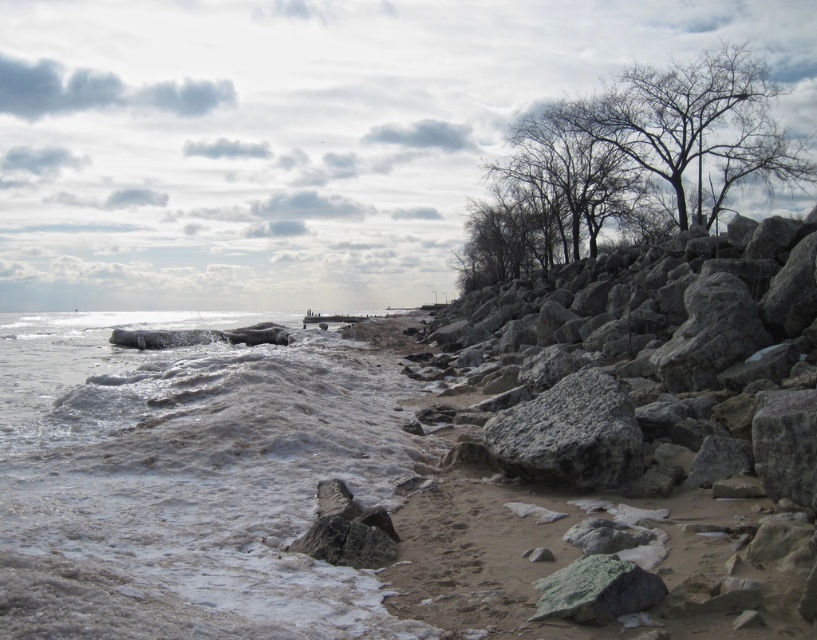
Question: Is white frothy water at lower left below gray rough rock at center-right?

Choices:
 (A) no
 (B) yes

Answer: (A)

Question: Can you confirm if white frothy water at lower left is bigger than bare branches at upper right?

Choices:
 (A) yes
 (B) no

Answer: (B)

Question: Which of these objects is positioned closest to the bare branches at upper right?

Choices:
 (A) white frothy water at lower left
 (B) gray rough rock at center-right

Answer: (A)

Question: Which is farther from the bare branches at upper right?

Choices:
 (A) white frothy water at lower left
 (B) gray rough rock at center-right

Answer: (B)

Question: Does white frothy water at lower left have a larger size compared to gray rough rock at center-right?

Choices:
 (A) yes
 (B) no

Answer: (A)

Question: Which point is farther to the camera?

Choices:
 (A) (576, 445)
 (B) (570, 257)
 (C) (288, 353)

Answer: (B)